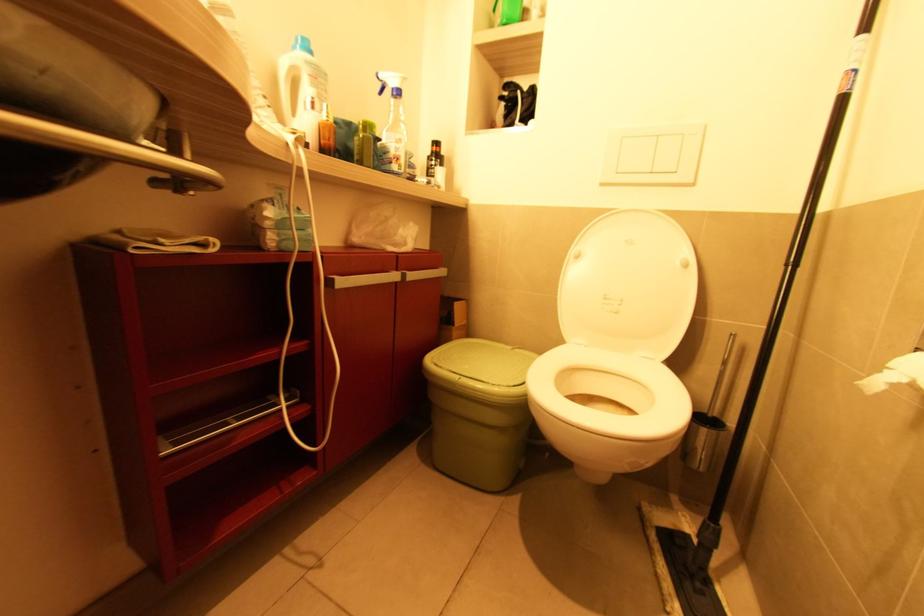
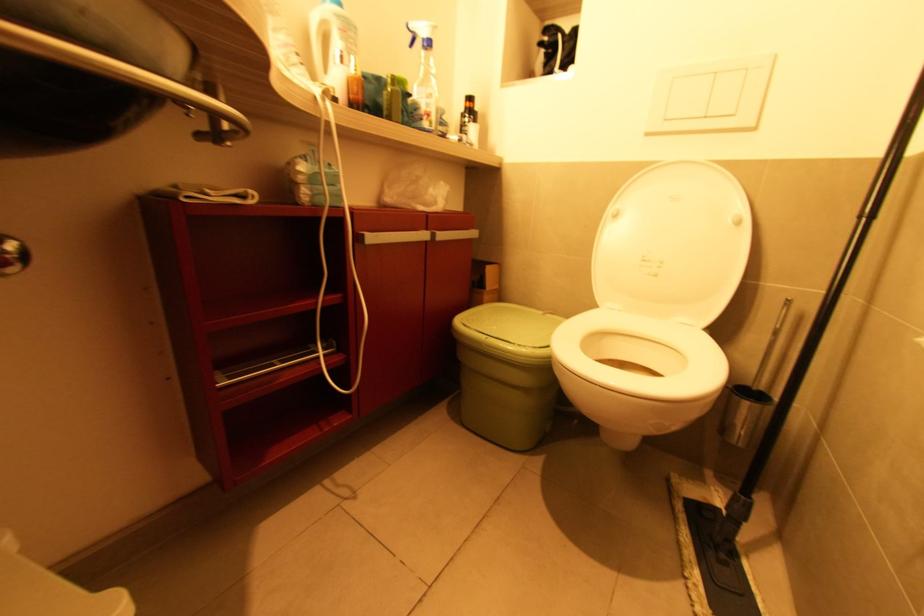
The point at (525, 386) is marked in the first image. Where is the corresponding point in the second image?

(551, 347)